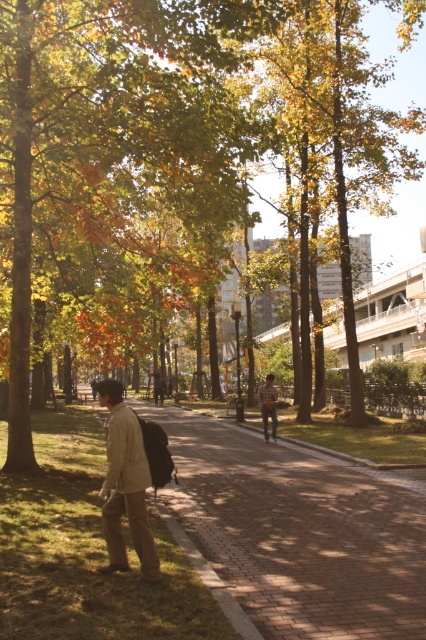
You are standing in the park and see the green leafy tree at center. If you want to take a photo of it with your smartphone, which has a maximum focus range of 10 meters, will you be able to capture it clearly?

The green leafy tree at center is 8.13 meters away from viewer, which is within the smartphone camera maximum focus range of 10 meters. So yes, you can capture it clearly.